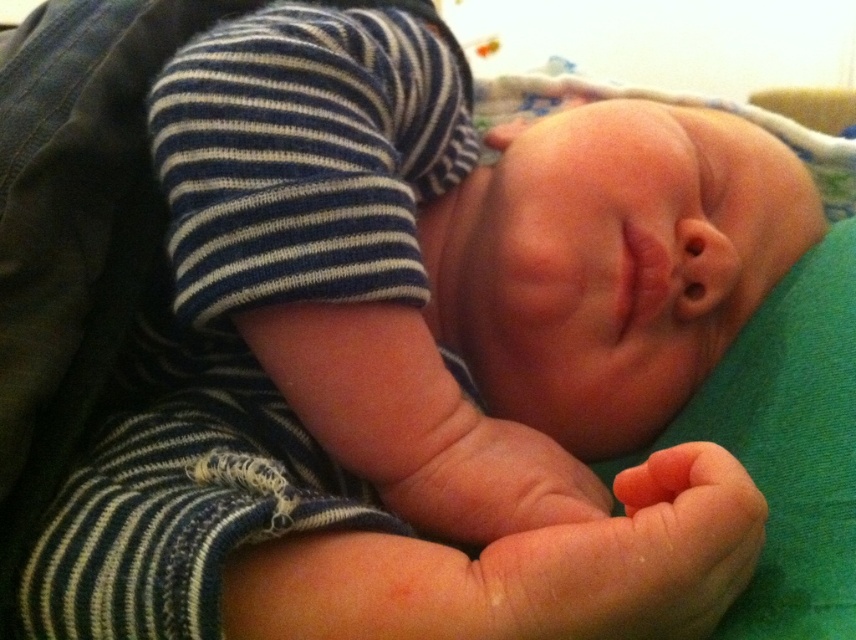
Question: Does pink soft skin at center have a larger size compared to smooth skin hand at center?

Choices:
 (A) no
 (B) yes

Answer: (A)

Question: Does pink soft skin at center have a greater width compared to smooth skin hand at center?

Choices:
 (A) no
 (B) yes

Answer: (A)

Question: Which point is closer to the camera?

Choices:
 (A) pink soft skin at center
 (B) smooth skin hand at center

Answer: (A)

Question: Can you confirm if pink soft skin at center is positioned below smooth skin hand at center?

Choices:
 (A) no
 (B) yes

Answer: (B)